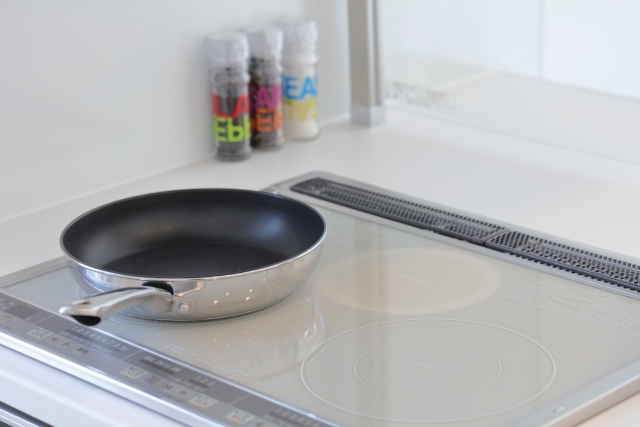
You are a GUI agent. You are given a task and a screenshot of the screen. Output one action in this format:
    pyautogui.click(x=<x>, y=<y>)
    Task: Click on the stove top
    This screenshot has width=640, height=427.
    Given the screenshot: What is the action you would take?
    pyautogui.click(x=324, y=328)